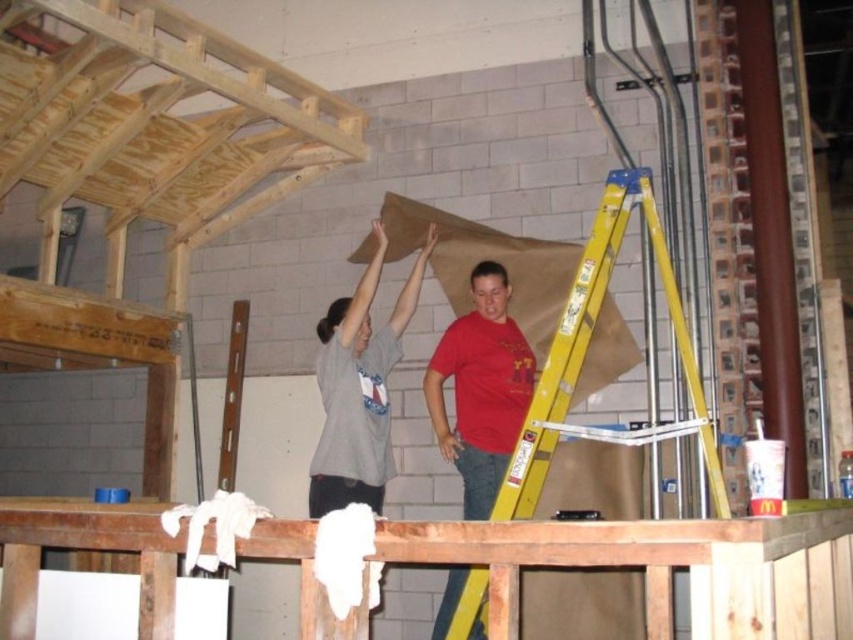
Question: Which object is positioned closest to the red matte shirt at center?

Choices:
 (A) yellow/yellowish metallic ladder at center
 (B) gray cotton t-shirt at center

Answer: (B)

Question: Where is yellow/yellowish metallic ladder at center located in relation to gray cotton t-shirt at center in the image?

Choices:
 (A) left
 (B) right

Answer: (B)

Question: Does yellow/yellowish metallic ladder at center appear under gray cotton t-shirt at center?

Choices:
 (A) no
 (B) yes

Answer: (B)

Question: Based on their relative distances, which object is nearer to the red matte shirt at center?

Choices:
 (A) yellow/yellowish metallic ladder at center
 (B) gray cotton t-shirt at center

Answer: (B)

Question: Can you confirm if yellow/yellowish metallic ladder at center is thinner than red matte shirt at center?

Choices:
 (A) no
 (B) yes

Answer: (A)

Question: Which point is closer to the camera?

Choices:
 (A) (398, 333)
 (B) (479, 467)
 (C) (556, 396)

Answer: (C)